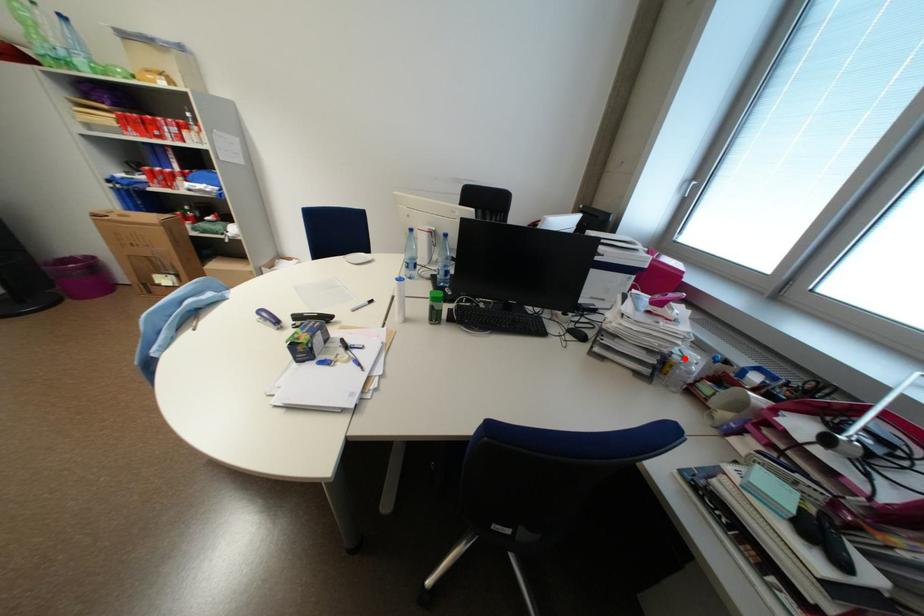
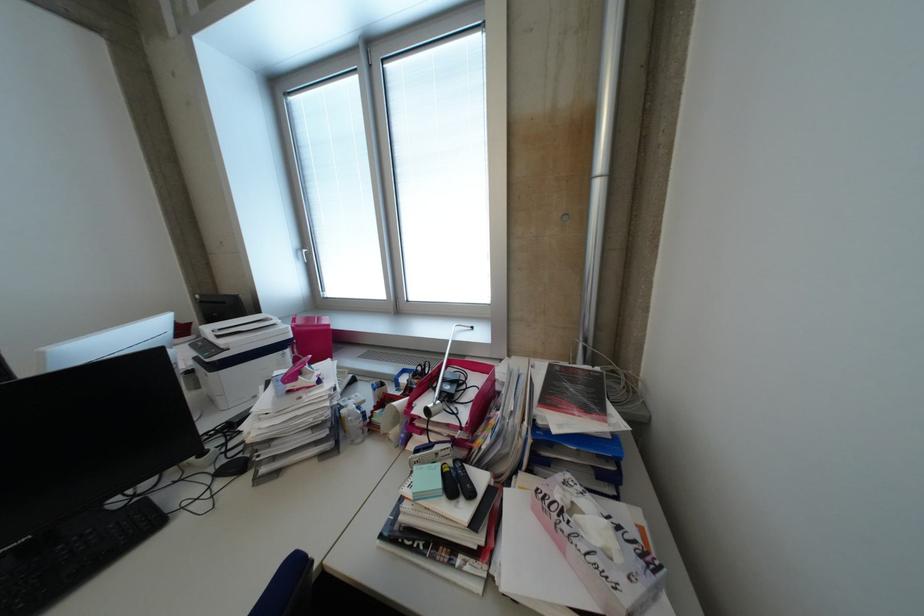
The point at the highlighted location is marked in the first image. Where is the corresponding point in the second image?

(351, 413)